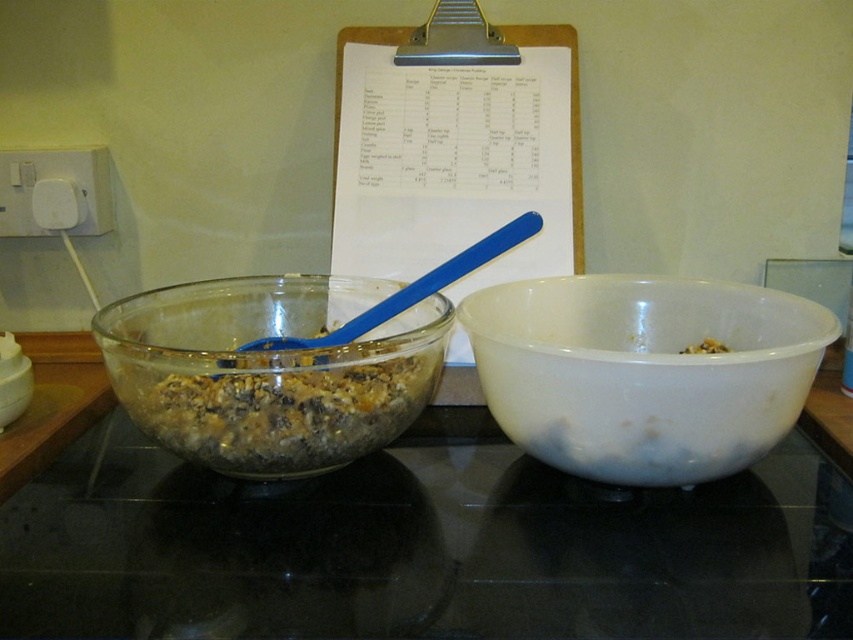
Question: Considering the real-world distances, which object is farthest from the transparent glass bowls at center?

Choices:
 (A) translucent glass bowl at left
 (B) white matte bowl at right
 (C) white glossy bowl at right

Answer: (B)

Question: Estimate the real-world distances between objects in this image. Which object is closer to the transparent glass bowls at center?

Choices:
 (A) translucent glass bowl at left
 (B) white matte bowl at right

Answer: (A)

Question: In this image, where is transparent glass bowls at center located relative to translucent glass bowl at left?

Choices:
 (A) left
 (B) right

Answer: (B)

Question: Is the position of transparent glass bowls at center more distant than that of white matte bowl at right?

Choices:
 (A) no
 (B) yes

Answer: (A)

Question: Can you confirm if white glossy bowl at right is bigger than translucent glass bowl at left?

Choices:
 (A) yes
 (B) no

Answer: (B)

Question: Which point appears closest to the camera in this image?

Choices:
 (A) (111, 307)
 (B) (532, 384)
 (C) (614, 602)

Answer: (C)